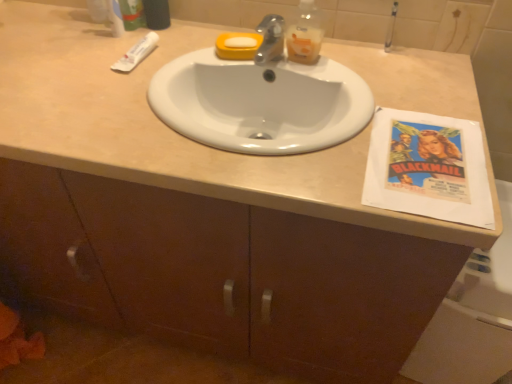
Find the location of a particular element. free space between white matte tube at upper left and green matte toothpaste tube at upper left is located at coordinates (133, 42).